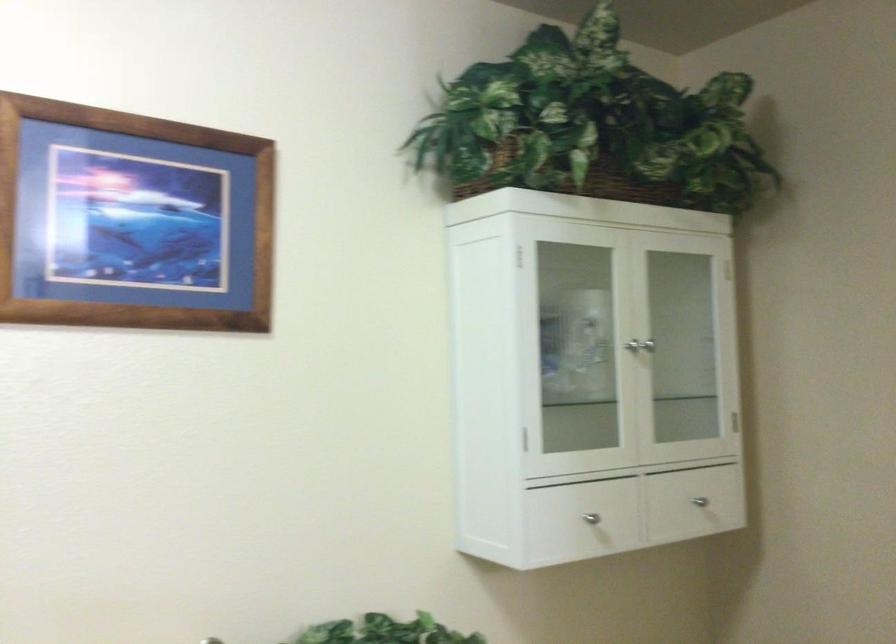
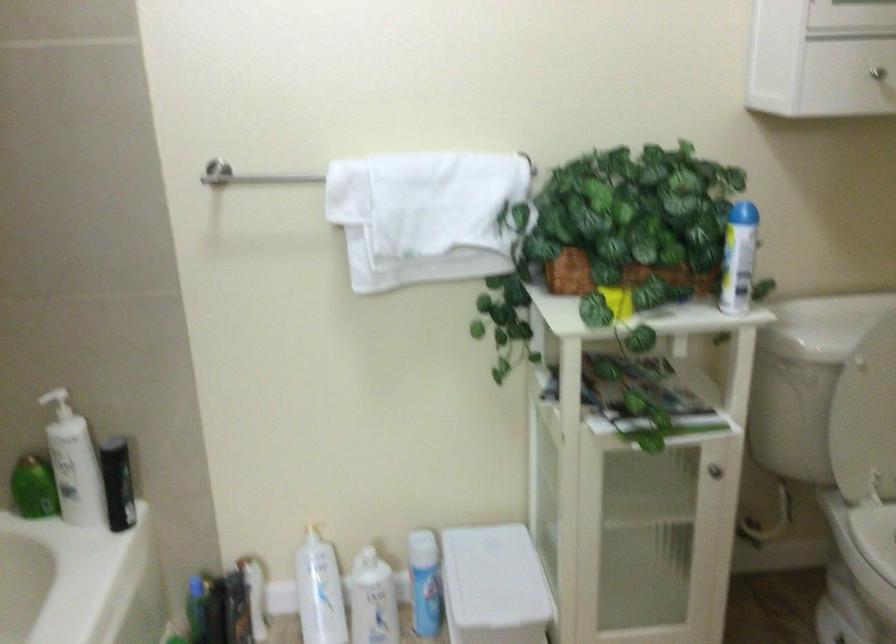
The first image is from the beginning of the video and the second image is from the end. How did the camera likely rotate when shooting the video?

The camera rotated toward left-down.